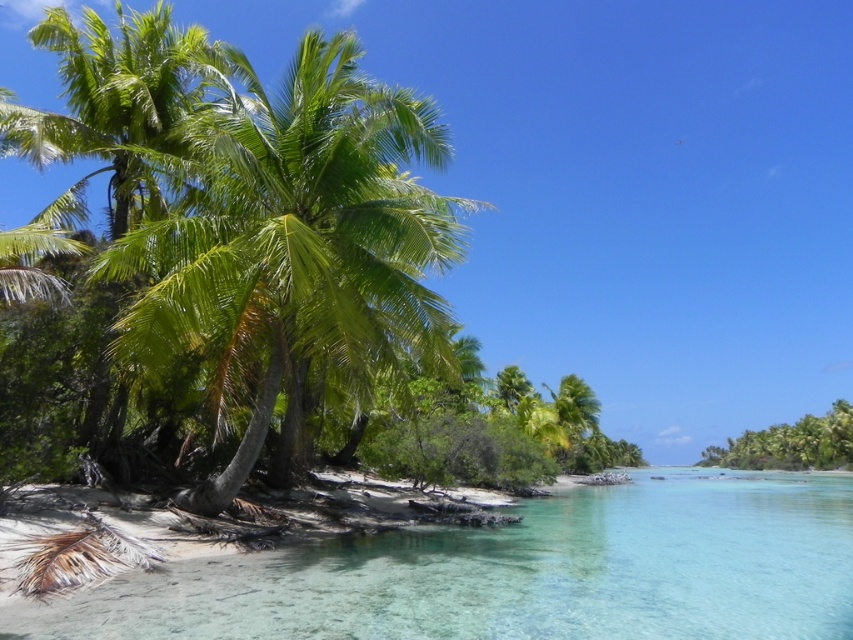
You are a beachgoer trying to decide where to place your beach umbrella. You have two options in the scene described. The first option is near the clear glass water at lower left, and the second is near the green leafy palm tree at left. Considering the size of these two areas, which location would allow for a larger umbrella setup?

The clear glass water at lower left has a larger size compared to the green leafy palm tree at left, so placing the beach umbrella near the clear glass water at lower left would allow for a larger setup.

You are standing on the beach and want to take a photo of both the clear glass water at lower left and the green leafy palm tree at left. Which object should you zoom in on first to ensure both are in frame?

You should zoom in on the clear glass water at lower left first because it is much taller than the green leafy palm tree at left, so adjusting the frame to accommodate its height will also include the palm tree.